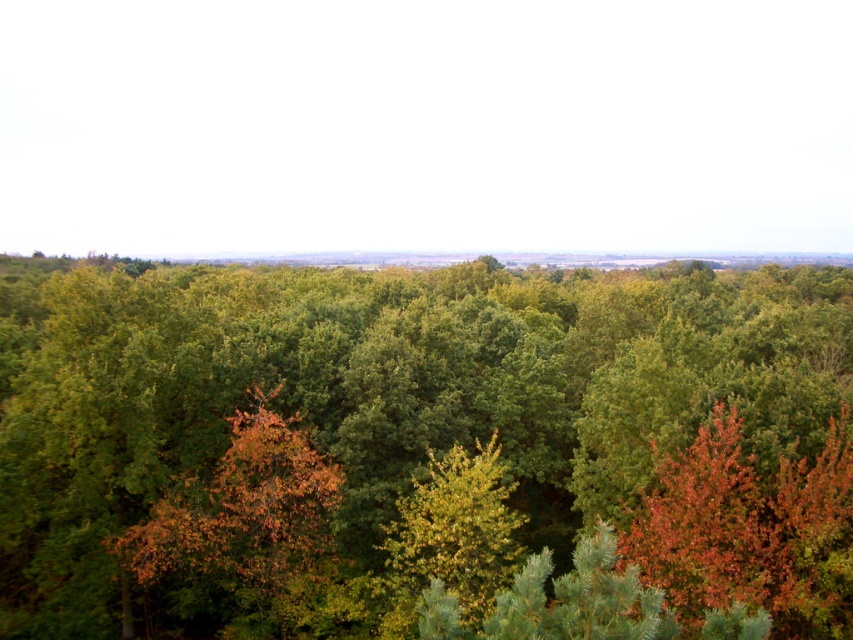
In the scene shown: You are an environmental scientist studying the forest. You observe the green leafy forest at center and the orange leafy tree at center. Which one has a greater height?

The green leafy forest at center is taller than the orange leafy tree at center.

You are a hiker trying to determine the best path through the forest. You notice the green leafy forest at center and the orange leafy tree at center. Which area would likely be easier to navigate, and why?

The orange leafy tree at center would likely be easier to navigate because it is smaller in size compared to the green leafy forest at center, making it less dense and more manageable to pass through.